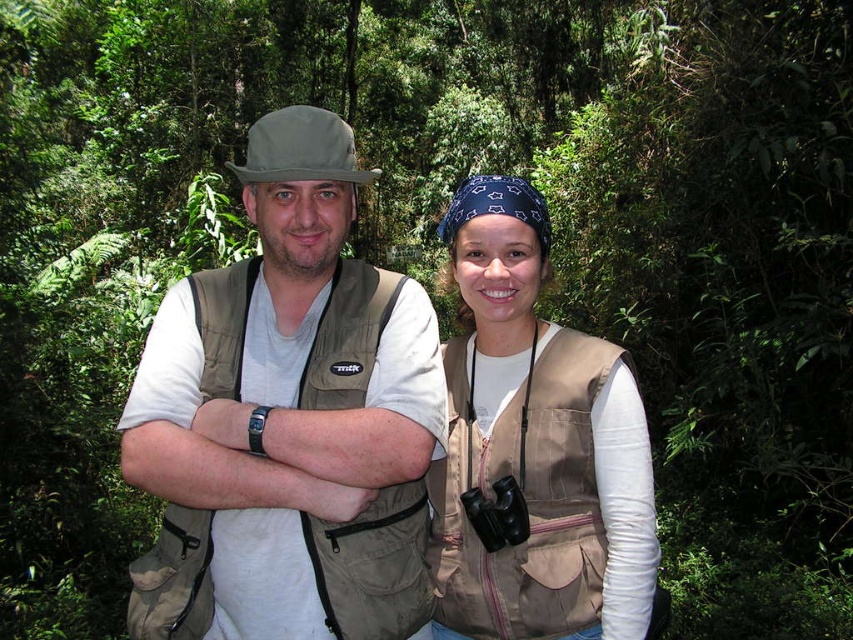
You are a hiker who wants to know which item on your outfit is taller between the khaki fabric hat at center and the tan canvas vest at center. Can you tell me which one is taller?

The khaki fabric hat at center has a greater height compared to the tan canvas vest at center, so the khaki fabric hat at center is taller.

You are a hiker who just found a khaki fabric hat at center. Where exactly is it located in the image?

The khaki fabric hat at center is located at point 0.656 on the horizontal axis and 0.339 on the vertical axis.